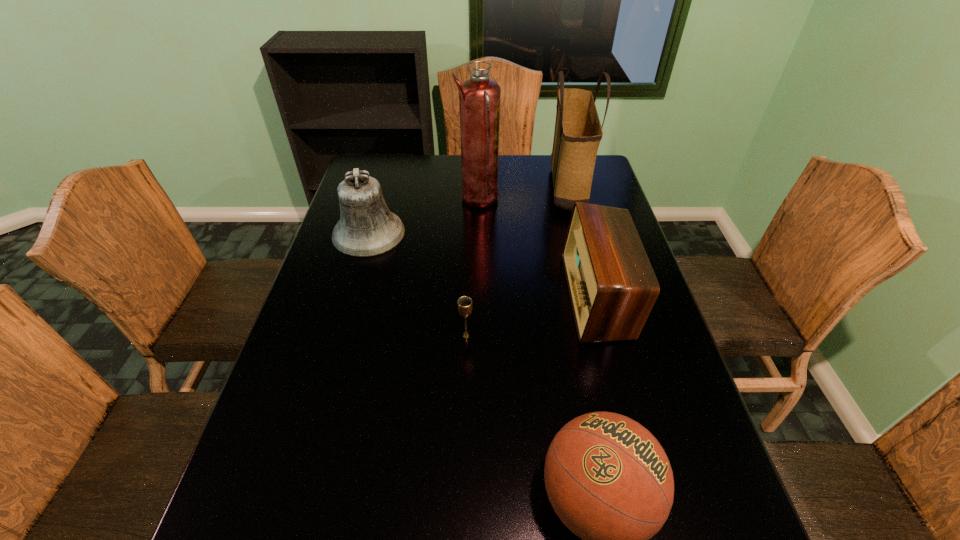
Where is `vacant point located on the front-facing side of the radio receiver`? The width and height of the screenshot is (960, 540). vacant point located on the front-facing side of the radio receiver is located at coordinates (452, 296).

Identify the location of blank space located 0.380m on the right of the shortest object. This screenshot has width=960, height=540. (629, 336).

I want to click on fire extinguisher at the far edge, so click(x=479, y=97).

The width and height of the screenshot is (960, 540). What are the coordinates of `tote bag at the far edge` in the screenshot? It's located at (578, 132).

Identify the location of object located at the left edge. This screenshot has height=540, width=960. (366, 228).

Image resolution: width=960 pixels, height=540 pixels. In order to click on tote bag at the right edge in this screenshot , I will do `click(578, 132)`.

The width and height of the screenshot is (960, 540). What are the coordinates of `radio receiver located at the right edge` in the screenshot? It's located at (612, 286).

Where is `object situated at the far right corner`? object situated at the far right corner is located at coordinates (578, 132).

Image resolution: width=960 pixels, height=540 pixels. In the image, there is a desktop. In order to click on vacant space at the left edge in this screenshot , I will do `click(318, 334)`.

The height and width of the screenshot is (540, 960). What are the coordinates of `vacant region at the right edge` in the screenshot? It's located at (611, 378).